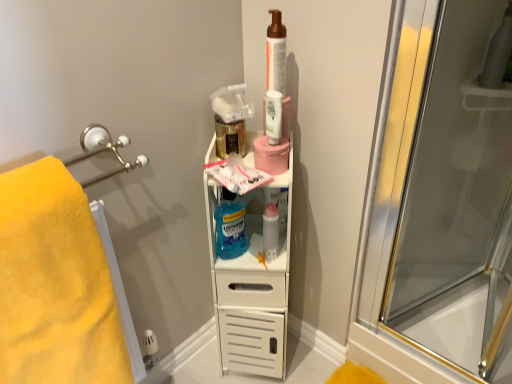
Question: In which direction should I rotate to look at blue translucent liquid mouthwash at center?

Choices:
 (A) right
 (B) left

Answer: (B)

Question: Does blue translucent liquid mouthwash at center appear on the left side of translucent plastic mouthwash at center, which is the first mouthwash from back to front?

Choices:
 (A) no
 (B) yes

Answer: (B)

Question: Can translucent plastic mouthwash at center, acting as the 1th mouthwash starting from the bottom, be found inside blue translucent liquid mouthwash at center?

Choices:
 (A) yes
 (B) no

Answer: (B)

Question: Does blue translucent liquid mouthwash at center have a lesser height compared to translucent plastic mouthwash at center, acting as the 1th mouthwash starting from the bottom?

Choices:
 (A) no
 (B) yes

Answer: (A)

Question: Is blue translucent liquid mouthwash at center facing towards translucent plastic mouthwash at center, arranged as the 2th mouthwash when viewed from the top?

Choices:
 (A) no
 (B) yes

Answer: (A)

Question: Does blue translucent liquid mouthwash at center have a greater width compared to translucent plastic mouthwash at center, which is the first mouthwash from back to front?

Choices:
 (A) no
 (B) yes

Answer: (B)

Question: Is blue translucent liquid mouthwash at center smaller than translucent plastic mouthwash at center, acting as the 1th mouthwash starting from the bottom?

Choices:
 (A) no
 (B) yes

Answer: (A)

Question: Considering the relative sizes of yellow soft towel at left and matte brown pump bottle at upper center in the image provided, is yellow soft towel at left bigger than matte brown pump bottle at upper center?

Choices:
 (A) no
 (B) yes

Answer: (B)

Question: Can you confirm if yellow soft towel at left is shorter than matte brown pump bottle at upper center?

Choices:
 (A) no
 (B) yes

Answer: (A)

Question: Does yellow soft towel at left lie behind matte brown pump bottle at upper center?

Choices:
 (A) yes
 (B) no

Answer: (B)

Question: From a real-world perspective, is yellow soft towel at left under matte brown pump bottle at upper center?

Choices:
 (A) yes
 (B) no

Answer: (A)

Question: Would you say yellow soft towel at left is a long distance from matte brown pump bottle at upper center?

Choices:
 (A) no
 (B) yes

Answer: (A)

Question: Is yellow soft towel at left oriented towards matte brown pump bottle at upper center?

Choices:
 (A) yes
 (B) no

Answer: (B)

Question: Considering the relative positions of yellow soft towel at left and blue translucent liquid mouthwash at center in the image provided, is yellow soft towel at left behind blue translucent liquid mouthwash at center?

Choices:
 (A) yes
 (B) no

Answer: (B)